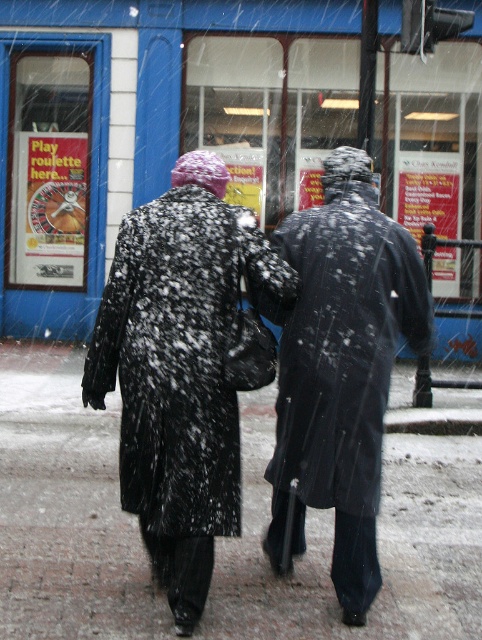
You are standing at the origin point of the coordinate system in the image. There is a blue glass window at center located at point (156, 124). If you want to walk towards the blue glass window at center, which direction should you move relative to your current position?

To move towards the blue glass window at center located at point (156, 124) from the origin, you should move in the direction of the coordinates increasing in both the x and y axes, as the point is in the positive quadrant relative to the origin.